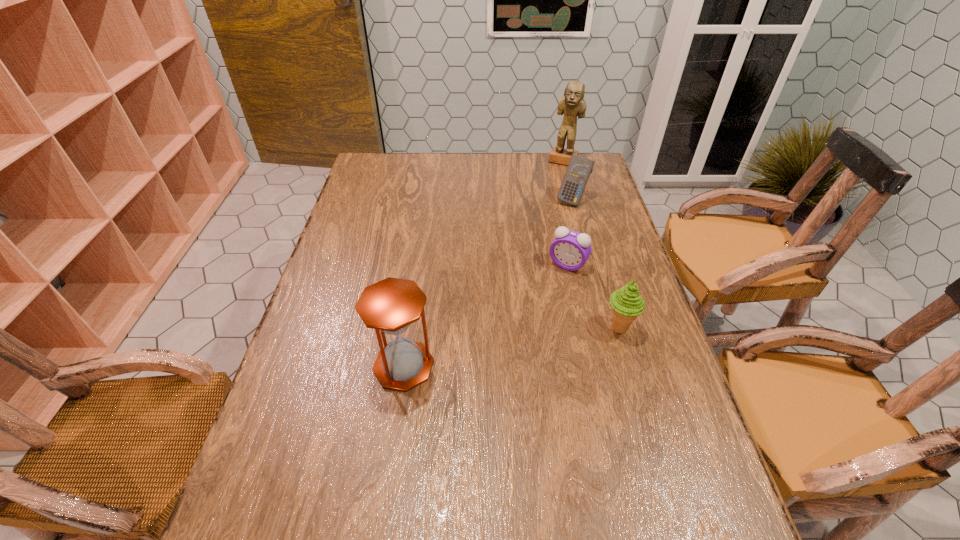
This screenshot has height=540, width=960. What are the coordinates of `blank space located 0.330m on the front-facing side of the fourth nearest object` in the screenshot? It's located at (538, 267).

At what (x,y) coordinates should I click in order to perform the action: click on free spot located on the front-facing side of the fourth nearest object. Please return your answer as a coordinate pair (x, y). Looking at the image, I should click on (535, 273).

This screenshot has height=540, width=960. Identify the location of free point located on the front-facing side of the fourth nearest object. (547, 247).

Find the location of a particular element. vacant space situated 0.060m on the front-facing side of the farthest object is located at coordinates (557, 175).

This screenshot has height=540, width=960. I want to click on free location located 0.110m on the front-facing side of the farthest object, so click(555, 181).

Identify the location of free space located on the front-facing side of the farthest object. (541, 220).

Find the location of a particular element. free space located 0.050m on the face of the third nearest object is located at coordinates (553, 285).

At what (x,y) coordinates should I click in order to perform the action: click on vacant space located 0.180m on the face of the third nearest object. Please return your answer as a coordinate pair (x, y). The image size is (960, 540). Looking at the image, I should click on (533, 315).

You are a GUI agent. You are given a task and a screenshot of the screen. Output one action in this format:
    pyautogui.click(x=<x>, y=<y>)
    Task: Click on the blank space located on the face of the third nearest object
    The height and width of the screenshot is (540, 960).
    Given the screenshot: What is the action you would take?
    pyautogui.click(x=501, y=364)

I want to click on object located at the far edge, so click(572, 104).